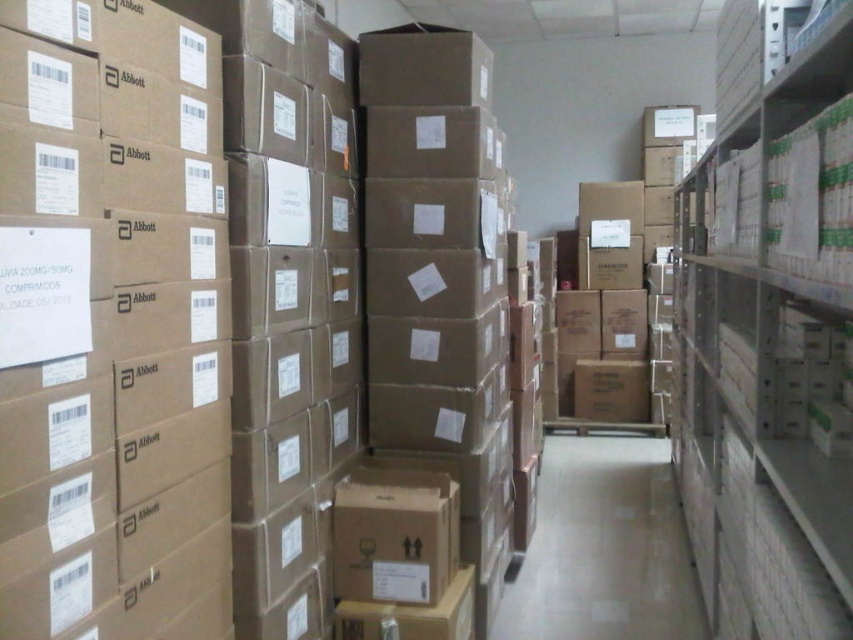
You are a warehouse worker who needs to move a box from the white cardboard boxes at right to the white glossy aisle at center. Which object is closer to you as you start moving?

The white cardboard boxes at right are closer to the viewer than the white glossy aisle at center, so you are closer to the white cardboard boxes at right when starting to move.

From the picture: You are a warehouse worker who needs to move a pallet from the entrance to the storage area. The entrance is located at the far left of the image. You see the white glossy aisle at center and the white cardboard boxes at right. Which direction should you move towards to reach the storage area without hitting the boxes?

You should move towards the white glossy aisle at center because the white cardboard boxes at right are to the right of it, so moving along the aisle will keep you clear of the boxes.

You are standing in the warehouse and want to reach a specific box labeled with the barcode at point (799,372). If your arm can extend 1.5 meters, can you reach the barcode without moving closer?

The point (799,372) is 1.73 meters away from the viewer, which is beyond the arm extension of 1.5 meters. Therefore, you cannot reach the barcode without moving closer.